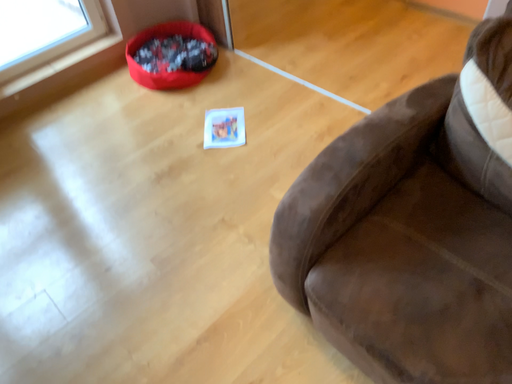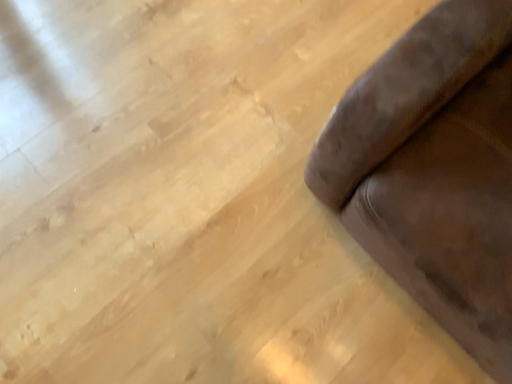
Question: Which way did the camera rotate in the video?

Choices:
 (A) rotated upward
 (B) rotated downward

Answer: (B)